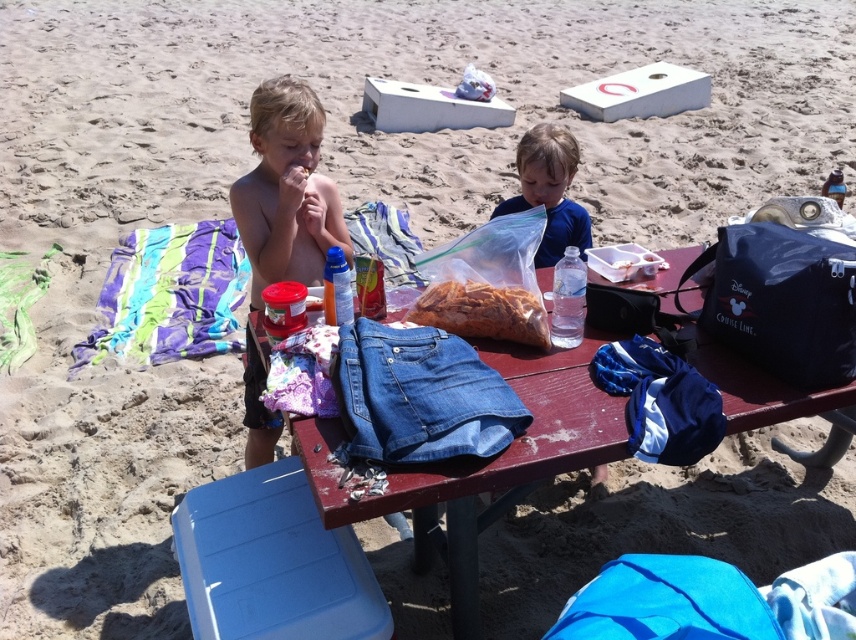
You are a parent trying to decide where to place a new snack plate. You see the wooden picnic table at center and the blue matte shirt at center. Which surface would be more appropriate for placing the snack plate?

The wooden picnic table at center is bigger than the blue matte shirt at center, so the wooden picnic table at center is the more appropriate surface for placing the snack plate.